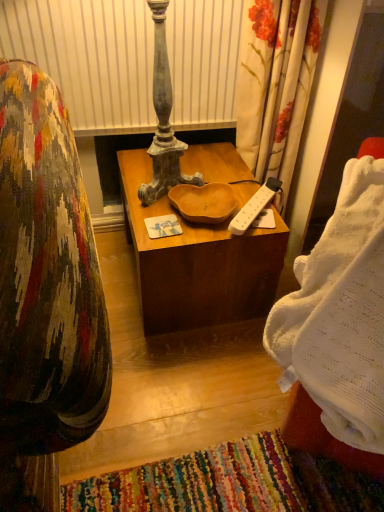
Question: Is white plastic power strip at center with wooden at center?

Choices:
 (A) no
 (B) yes

Answer: (A)

Question: Is white plastic power strip at center to the left of wooden at center from the viewer's perspective?

Choices:
 (A) no
 (B) yes

Answer: (A)

Question: From a real-world perspective, is white plastic power strip at center located beneath wooden at center?

Choices:
 (A) no
 (B) yes

Answer: (A)

Question: Is wooden at center completely or partially inside white plastic power strip at center?

Choices:
 (A) no
 (B) yes

Answer: (A)

Question: Considering the relative sizes of white plastic power strip at center and wooden at center in the image provided, is white plastic power strip at center wider than wooden at center?

Choices:
 (A) no
 (B) yes

Answer: (A)

Question: Is white plastic power strip at center to the left or to the right of wooden at center in the image?

Choices:
 (A) left
 (B) right

Answer: (B)

Question: From the image's perspective, is white plastic power strip at center positioned above or below wooden at center?

Choices:
 (A) below
 (B) above

Answer: (B)

Question: Looking at their shapes, would you say white plastic power strip at center is wider or thinner than wooden at center?

Choices:
 (A) wide
 (B) thin

Answer: (B)

Question: Based on their sizes in the image, would you say white plastic power strip at center is bigger or smaller than wooden at center?

Choices:
 (A) small
 (B) big

Answer: (A)

Question: Based on their sizes in the image, would you say white knitted blanket at right is bigger or smaller than white plastic power strip at center?

Choices:
 (A) big
 (B) small

Answer: (A)

Question: Considering their positions, is white knitted blanket at right located in front of or behind white plastic power strip at center?

Choices:
 (A) front
 (B) behind

Answer: (A)

Question: Is white knitted blanket at right taller or shorter than white plastic power strip at center?

Choices:
 (A) short
 (B) tall

Answer: (B)

Question: Is point (322, 373) closer or farther from the camera than point (243, 217)?

Choices:
 (A) closer
 (B) farther

Answer: (A)

Question: Considering the relative positions of white knitted blanket at right and wooden at center in the image provided, is white knitted blanket at right to the left or to the right of wooden at center?

Choices:
 (A) right
 (B) left

Answer: (A)

Question: Is white knitted blanket at right in front of or behind wooden at center in the image?

Choices:
 (A) behind
 (B) front

Answer: (B)